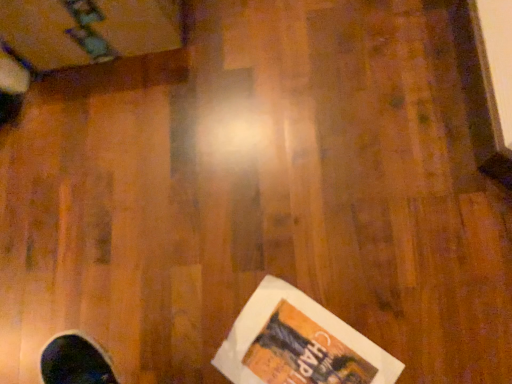
Question: Should I look upward or downward to see white paper flyer at lower right?

Choices:
 (A) down
 (B) up

Answer: (A)